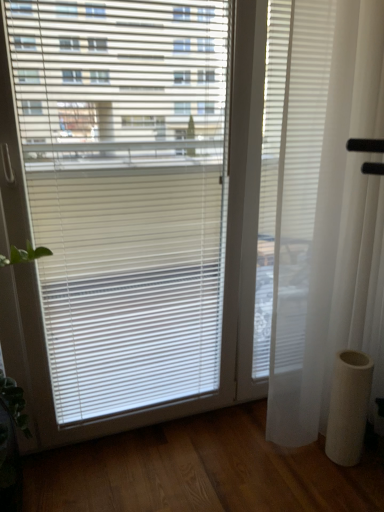
Question: Is white sheer curtain at right thinner than white matte cylinder at lower right?

Choices:
 (A) yes
 (B) no

Answer: (B)

Question: Does white sheer curtain at right have a larger size compared to white matte cylinder at lower right?

Choices:
 (A) yes
 (B) no

Answer: (A)

Question: Does white sheer curtain at right have a smaller size compared to white matte cylinder at lower right?

Choices:
 (A) yes
 (B) no

Answer: (B)

Question: Is white sheer curtain at right taller than white matte cylinder at lower right?

Choices:
 (A) no
 (B) yes

Answer: (B)

Question: From the image's perspective, does white sheer curtain at right appear lower than white matte cylinder at lower right?

Choices:
 (A) no
 (B) yes

Answer: (A)

Question: Is white sheer curtain at right located outside white matte cylinder at lower right?

Choices:
 (A) yes
 (B) no

Answer: (A)

Question: Is white matte cylinder at lower right behind white sheer curtain at right?

Choices:
 (A) no
 (B) yes

Answer: (B)

Question: Is white matte cylinder at lower right aimed at white sheer curtain at right?

Choices:
 (A) no
 (B) yes

Answer: (A)

Question: Does white matte cylinder at lower right have a lesser width compared to white sheer curtain at right?

Choices:
 (A) yes
 (B) no

Answer: (A)

Question: Considering the relative sizes of white matte cylinder at lower right and white sheer curtain at right in the image provided, is white matte cylinder at lower right bigger than white sheer curtain at right?

Choices:
 (A) no
 (B) yes

Answer: (A)

Question: Is white sheer curtain at right located within white matte cylinder at lower right?

Choices:
 (A) no
 (B) yes

Answer: (A)

Question: Can you confirm if white matte cylinder at lower right is smaller than white sheer curtain at right?

Choices:
 (A) yes
 (B) no

Answer: (A)

Question: Considering the positions of white sheer curtain at right and white matte cylinder at lower right in the image, is white sheer curtain at right wider or thinner than white matte cylinder at lower right?

Choices:
 (A) wide
 (B) thin

Answer: (A)